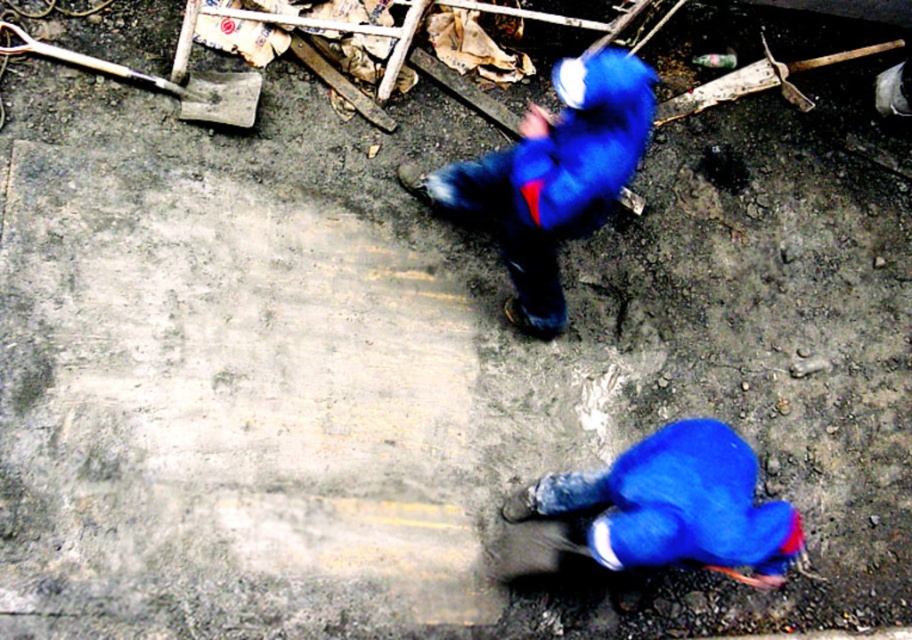
Looking at this image, you are a delivery person who needs to place a heavy box between the blue fabric construction worker at lower right and the metallic silver shovel at upper left. Is there enough space between them to fit the box?

The blue fabric construction worker at lower right is to the right of the metallic silver shovel at upper left, so there is space between them to place the box.

You are a supervisor at the construction site and want to ensure safety gear is properly worn. Which object among the blue fabric construction worker at lower right and the metallic silver shovel at upper left has a larger width?

The blue fabric construction worker at lower right has a larger width than the metallic silver shovel at upper left.